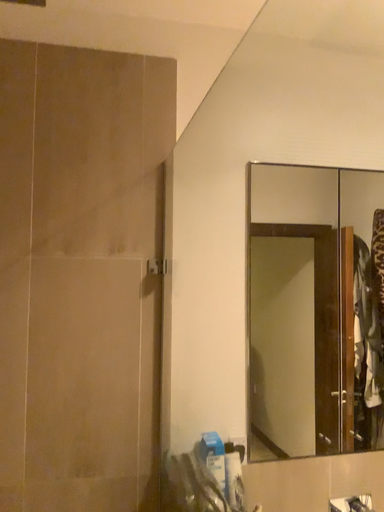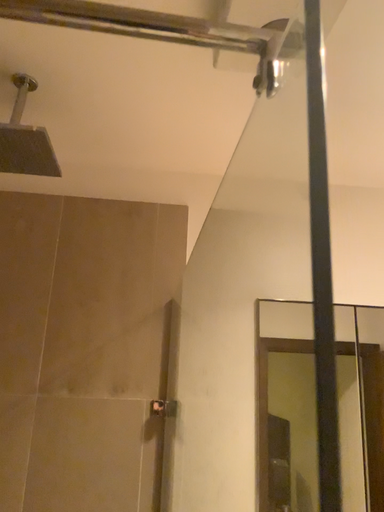
Question: How did the camera likely rotate when shooting the video?

Choices:
 (A) rotated left
 (B) rotated right

Answer: (A)